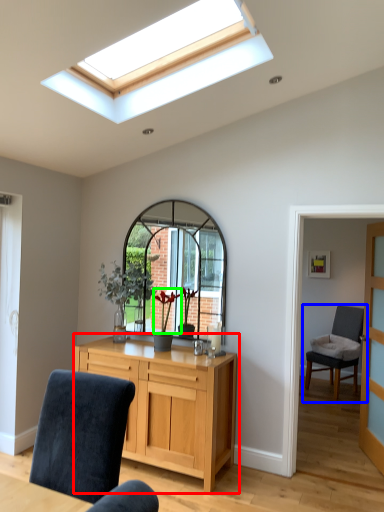
Question: Estimate the real-world distances between objects in this image. Which object is closer to chest of drawers (highlighted by a red box), chair (highlighted by a blue box) or flower (highlighted by a green box)?

Choices:
 (A) chair
 (B) flower

Answer: (B)